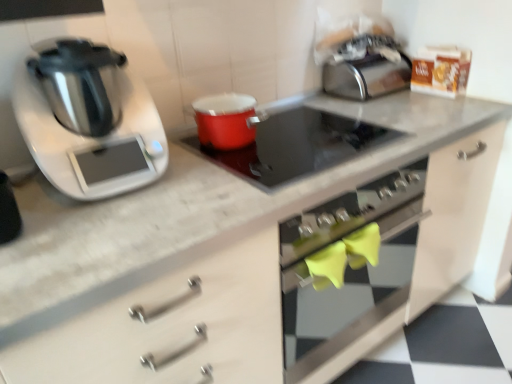
Question: Is satin silver toaster at upper right taller or shorter than smooth glass cooktop at center?

Choices:
 (A) short
 (B) tall

Answer: (B)

Question: Is point (354, 66) positioned closer to the camera than point (268, 130)?

Choices:
 (A) farther
 (B) closer

Answer: (A)

Question: Estimate the real-world distances between objects in this image. Which object is farther from the matte red pot at center?

Choices:
 (A) smooth glass cooktop at center
 (B) shiny metallic pressure cooker at left
 (C) satin silver toaster at upper right

Answer: (C)

Question: Which object is positioned farthest from the matte red pot at center?

Choices:
 (A) satin silver toaster at upper right
 (B) shiny metallic pressure cooker at left
 (C) smooth glass cooktop at center

Answer: (A)